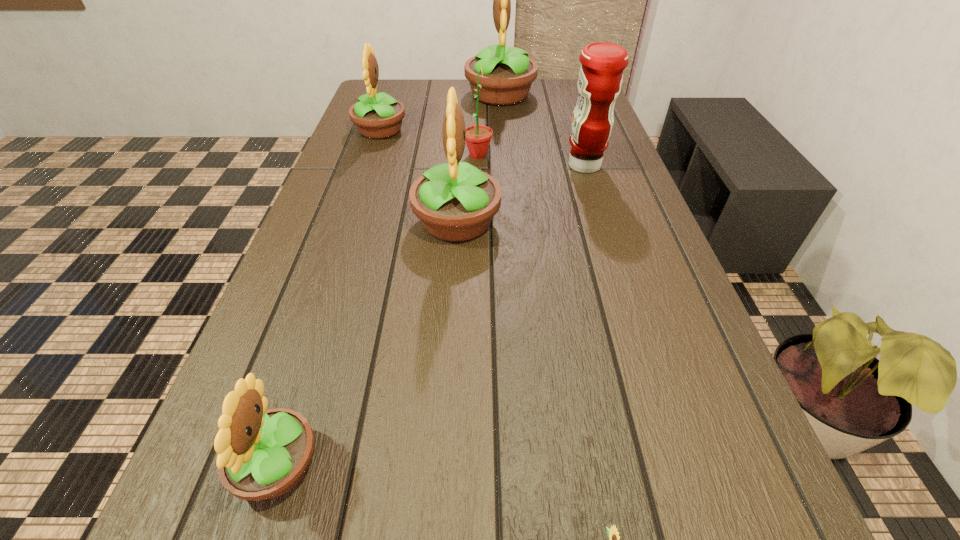
This screenshot has width=960, height=540. In order to click on the tallest object in this screenshot , I will do `click(508, 73)`.

I want to click on the farthest sunflower, so click(x=508, y=73).

Where is `the fifth shortest sunflower`? This screenshot has height=540, width=960. the fifth shortest sunflower is located at coordinates (455, 202).

This screenshot has width=960, height=540. Find the location of `the fifth farthest object`. the fifth farthest object is located at coordinates (455, 202).

Where is `the rightmost object`? The height and width of the screenshot is (540, 960). the rightmost object is located at coordinates (x=600, y=78).

Where is `condiment`? condiment is located at coordinates (600, 78).

Locate an element on the screen. The image size is (960, 540). the second farthest object is located at coordinates (379, 116).

You are a GUI agent. You are given a task and a screenshot of the screen. Output one action in this format:
    pyautogui.click(x=<x>, y=<y>)
    Task: Click on the second farthest yellow sunflower
    
    Given the screenshot: What is the action you would take?
    pyautogui.click(x=379, y=116)

I want to click on the left green sunflower, so click(x=478, y=137).

The width and height of the screenshot is (960, 540). Find the location of `the fourth nearest sunflower`. the fourth nearest sunflower is located at coordinates (478, 137).